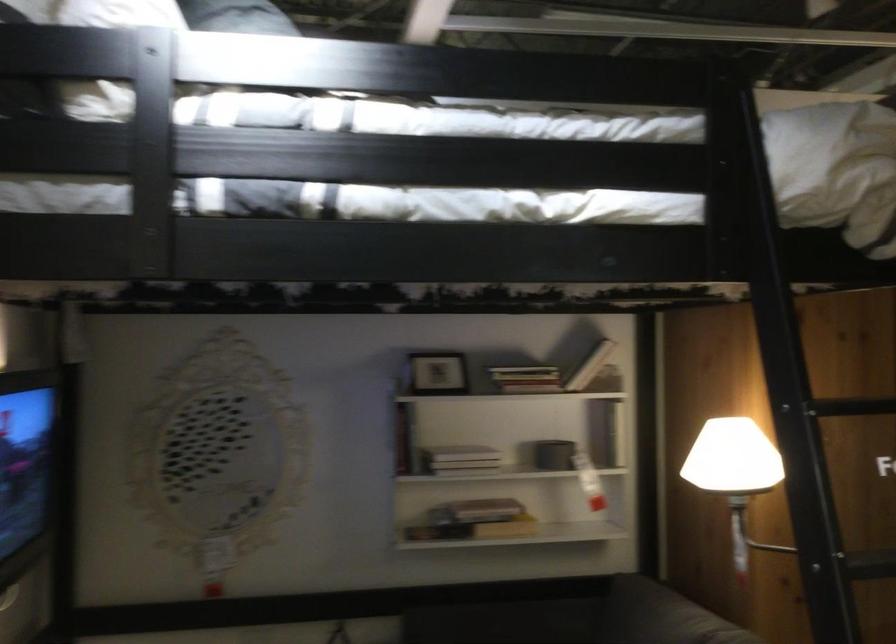
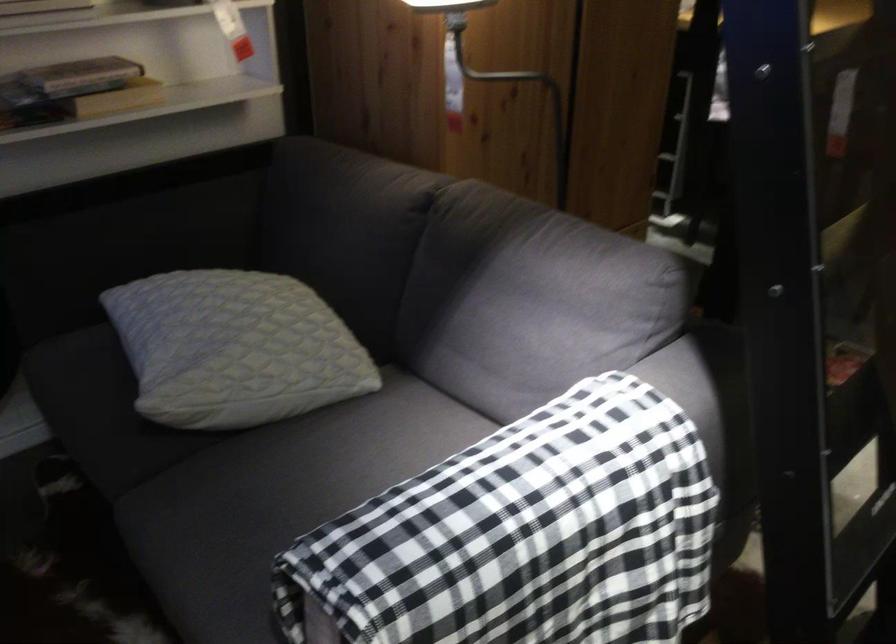
First-person continuous shooting, in which direction is the camera rotating?

The rotation direction of the camera is right-down.